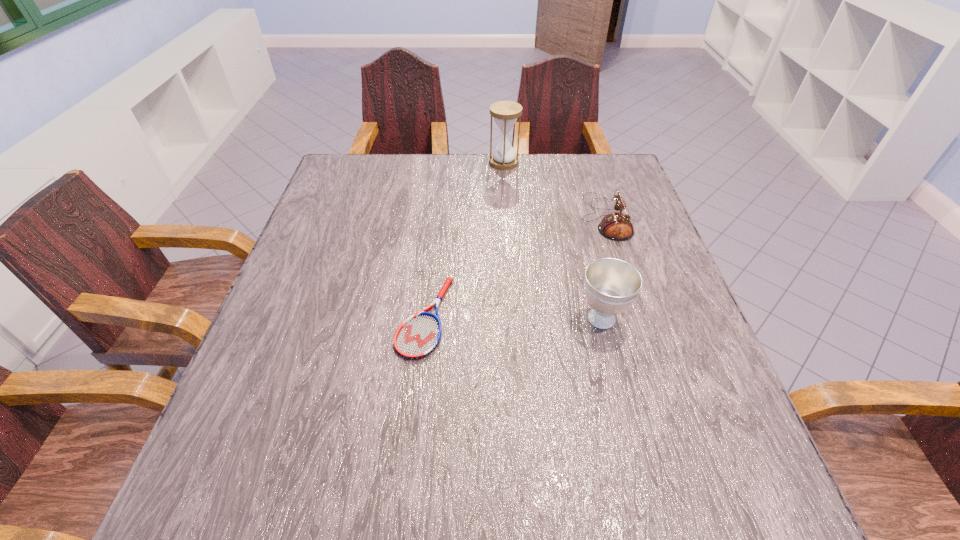
Where is `vacant space located on the rotary dial of the telephone`? vacant space located on the rotary dial of the telephone is located at coordinates (467, 218).

You are a GUI agent. You are given a task and a screenshot of the screen. Output one action in this format:
    pyautogui.click(x=<x>, y=<y>)
    Task: Click on the free space located on the rotary dial of the telephone
    
    Given the screenshot: What is the action you would take?
    pyautogui.click(x=552, y=218)

The width and height of the screenshot is (960, 540). I want to click on free space located on the right of the tennis racket, so click(x=507, y=317).

Image resolution: width=960 pixels, height=540 pixels. In order to click on hourglass present at the far edge in this screenshot , I will do `click(505, 113)`.

The image size is (960, 540). Identify the location of telephone present at the far edge. (616, 226).

The height and width of the screenshot is (540, 960). Find the location of `chalice located at the right edge`. chalice located at the right edge is located at coordinates (611, 285).

Locate an element on the screen. The image size is (960, 540). telephone that is at the right edge is located at coordinates (616, 226).

What are the coordinates of `object that is positioned at the far right corner` in the screenshot? It's located at (616, 226).

At what (x,y) coordinates should I click in order to perform the action: click on blank area at the far edge. Please return your answer as a coordinate pair (x, y). Looking at the image, I should click on (443, 167).

In the image, there is a desktop. Where is `vacant space at the near edge`? This screenshot has height=540, width=960. vacant space at the near edge is located at coordinates (342, 477).